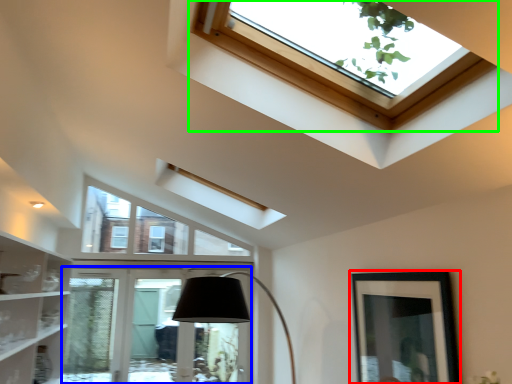
Question: Based on their relative distances, which object is nearer to picture frame (highlighted by a red box)? Choose from glass door (highlighted by a blue box) and window (highlighted by a green box).

Choices:
 (A) glass door
 (B) window

Answer: (B)